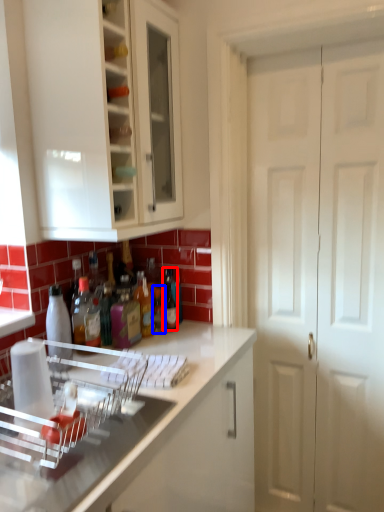
Question: Which object appears farthest to the camera in this image, bottle (highlighted by a red box) or bottle (highlighted by a blue box)?

Choices:
 (A) bottle
 (B) bottle

Answer: (B)